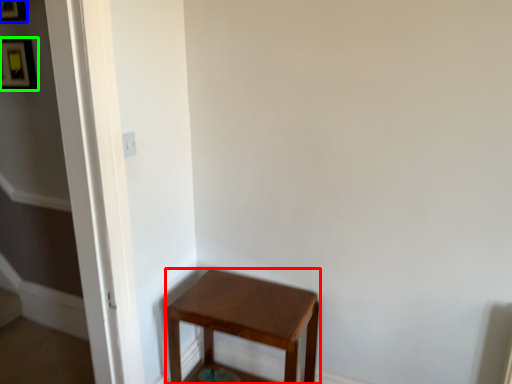
Question: Estimate the real-world distances between objects in this image. Which object is closer to stool (highlighted by a red box), picture frame (highlighted by a blue box) or picture frame (highlighted by a green box)?

Choices:
 (A) picture frame
 (B) picture frame

Answer: (B)